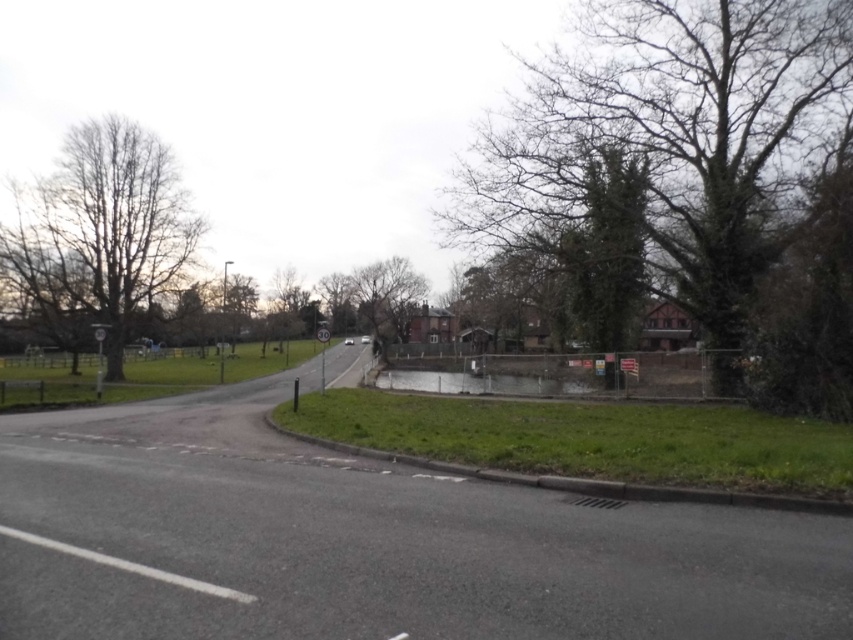
Is bare branches at upper right positioned behind bare wood tree at left?

No.

Which is in front, point (664, 262) or point (131, 257)?

Point (664, 262) is more forward.

Does point (779, 134) come in front of point (115, 221)?

That is True.

Locate an element on the screen. bare branches at upper right is located at coordinates click(670, 141).